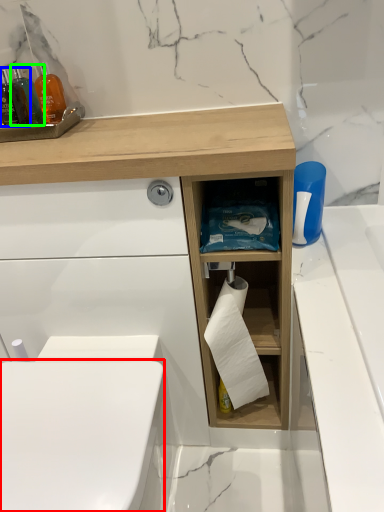
Question: Which object is positioned farthest from toilet bowl (highlighted by a red box)? Select from mouthwash (highlighted by a blue box) and mouthwash (highlighted by a green box).

Choices:
 (A) mouthwash
 (B) mouthwash

Answer: (B)